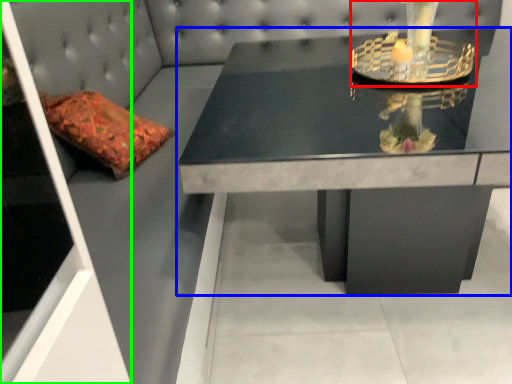
Question: Which object is positioned farthest from candle holder (highlighted by a red box)? Select from table (highlighted by a blue box) and glass door (highlighted by a green box).

Choices:
 (A) table
 (B) glass door

Answer: (B)